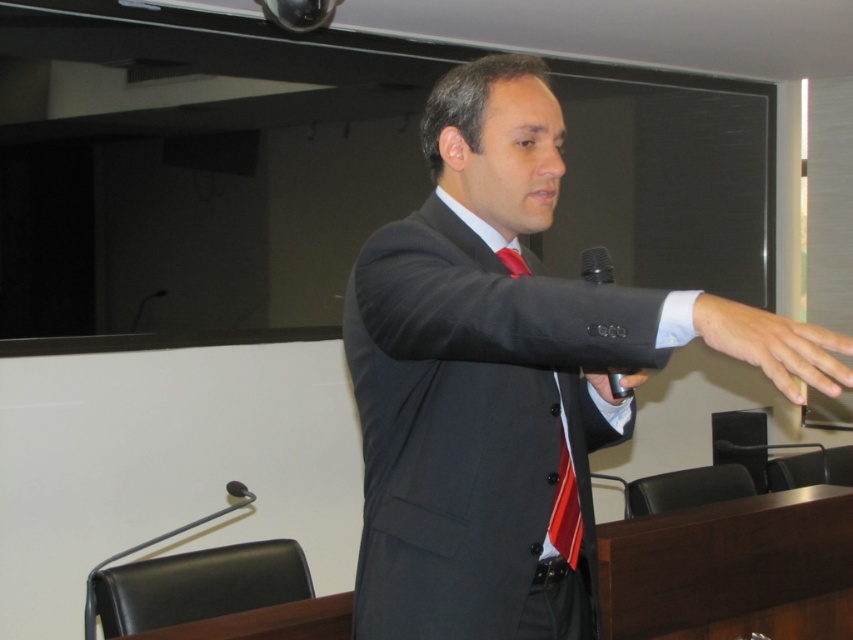
You are a photographer adjusting the focus on your camera to capture the man giving his presentation. The camera is set to focus on objects 32.53 inches away. Which object in the scene should you focus on to ensure the smooth skin hand at right is in sharp focus?

The smooth skin hand at right is 32.53 inches away from the camera, so focusing on it will ensure it is in sharp focus.

You are an event assistant who needs to place a new speaker at the podium. The podium has a microphone and a remote control. Where should you place the new speaker so that they can easily access both the black metallic microphone at lower left and the metallic silver remote at center?

The metallic silver remote at center is positioned on the right side of black metallic microphone at lower left, so the new speaker should stand to the left side of the black metallic microphone at lower left to have easy access to both items.